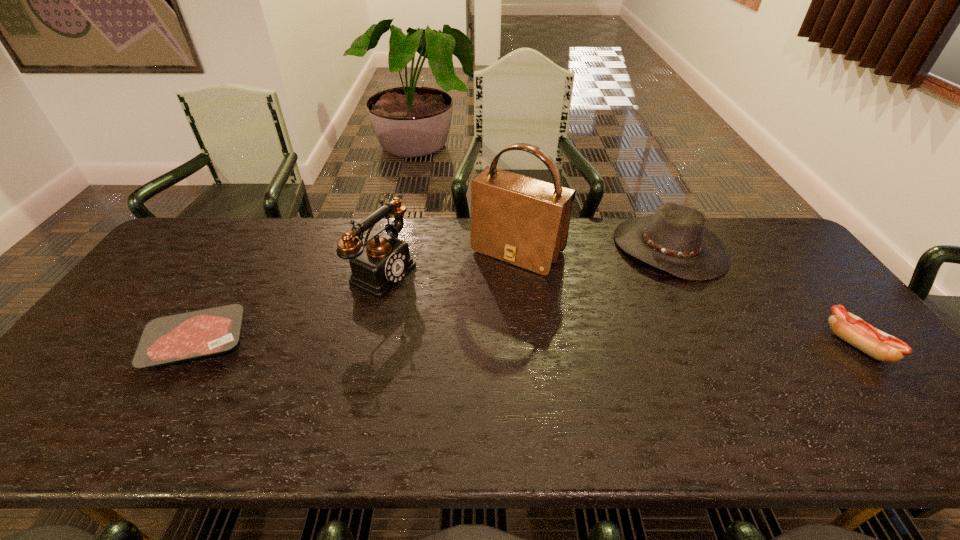
I want to click on empty location between the rightmost object and the shoulder bag, so click(x=687, y=298).

At what (x,y) coordinates should I click in order to perform the action: click on free space between the shoulder bag and the steak. Please return your answer as a coordinate pair (x, y). Looking at the image, I should click on (357, 297).

The width and height of the screenshot is (960, 540). What are the coordinates of `empty location between the leftmost object and the third object from right to left` in the screenshot? It's located at click(x=357, y=297).

Locate an element on the screen. vacant region between the leftmost object and the third object from right to left is located at coordinates (357, 297).

Where is `object that is the closest to the third object from right to left`? This screenshot has width=960, height=540. object that is the closest to the third object from right to left is located at coordinates (384, 261).

Find the location of a particular element. This screenshot has width=960, height=540. object that stands as the third closest to the second tallest object is located at coordinates (675, 239).

The width and height of the screenshot is (960, 540). I want to click on free location that satisfies the following two spatial constraints: 1. on the front side of the rightmost object; 2. on the left side of the third shortest object, so click(719, 345).

Find the location of `free space in the image that satisfies the following two spatial constraints: 1. on the back side of the third object from left to right; 2. on the left side of the leftmost object`. free space in the image that satisfies the following two spatial constraints: 1. on the back side of the third object from left to right; 2. on the left side of the leftmost object is located at coordinates point(252,252).

Find the location of `vacant area that satisfies the following two spatial constraints: 1. on the back side of the shoulder bag; 2. on the right side of the fourth object from right to left`. vacant area that satisfies the following two spatial constraints: 1. on the back side of the shoulder bag; 2. on the right side of the fourth object from right to left is located at coordinates (389, 252).

The image size is (960, 540). Identify the location of vacant space that satisfies the following two spatial constraints: 1. on the back side of the hat; 2. on the right side of the steak. (253, 248).